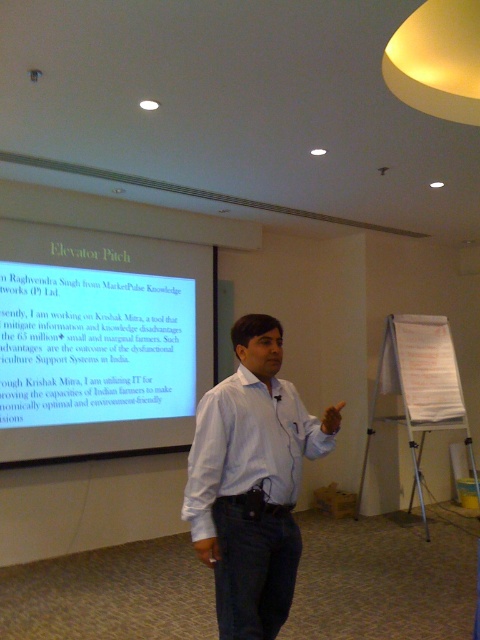
Can you confirm if white glossy projector screen at upper left is positioned to the right of white shirt at center?

No, white glossy projector screen at upper left is not to the right of white shirt at center.

At what (x,y) coordinates should I click in order to perform the action: click on white glossy projector screen at upper left. Please return your answer as a coordinate pair (x, y). The image size is (480, 640). Looking at the image, I should click on (99, 340).

Is point (99, 440) closer to camera compared to point (237, 442)?

No, it is behind (237, 442).

Where is `white glossy projector screen at upper left`? The height and width of the screenshot is (640, 480). white glossy projector screen at upper left is located at coordinates (99, 340).